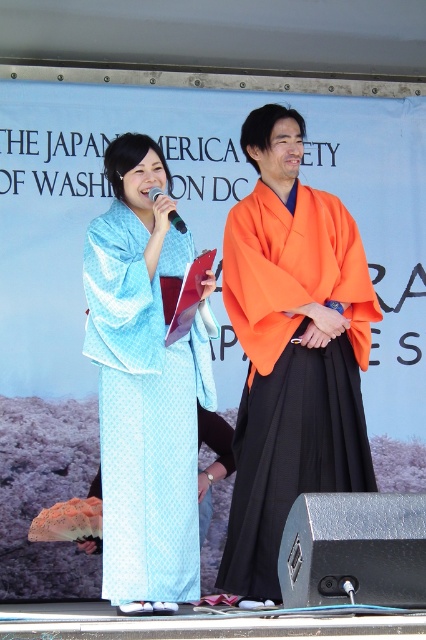
Question: Which of the following is the farthest from the observer?

Choices:
 (A) light blue silk kimono at center
 (B) orange silk kimono at center
 (C) black plastic microphone at center

Answer: (C)

Question: Estimate the real-world distances between objects in this image. Which object is farther from the orange silk kimono at center?

Choices:
 (A) light blue silk kimono at center
 (B) black plastic microphone at center

Answer: (B)

Question: Can you confirm if light blue silk kimono at center is wider than orange silk kimono at center?

Choices:
 (A) no
 (B) yes

Answer: (A)

Question: Can you confirm if light blue silk kimono at center is smaller than black plastic microphone at center?

Choices:
 (A) yes
 (B) no

Answer: (B)

Question: Can you confirm if orange silk kimono at center is positioned to the left of black plastic microphone at center?

Choices:
 (A) yes
 (B) no

Answer: (B)

Question: Among these points, which one is nearest to the camera?

Choices:
 (A) [x=106, y=545]
 (B) [x=184, y=225]

Answer: (A)